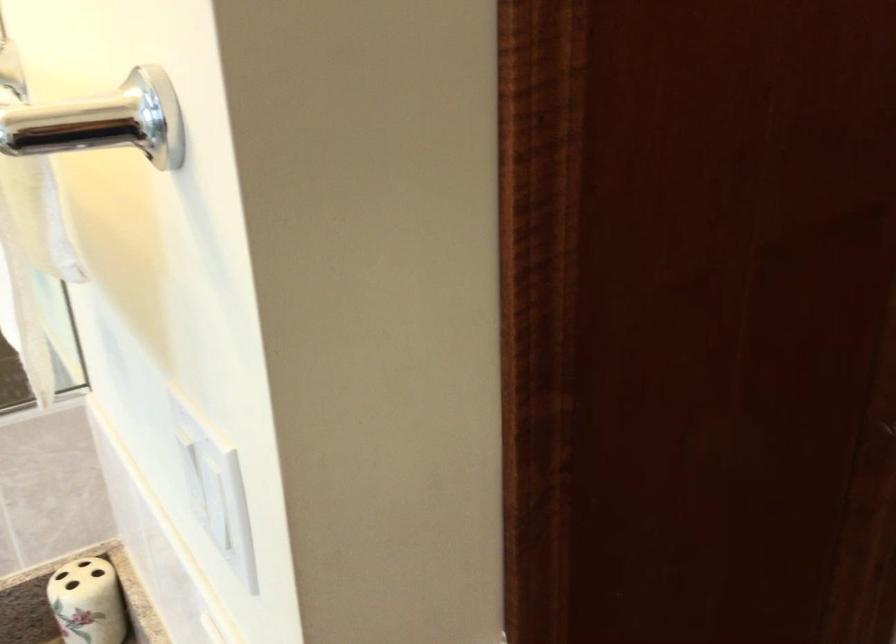
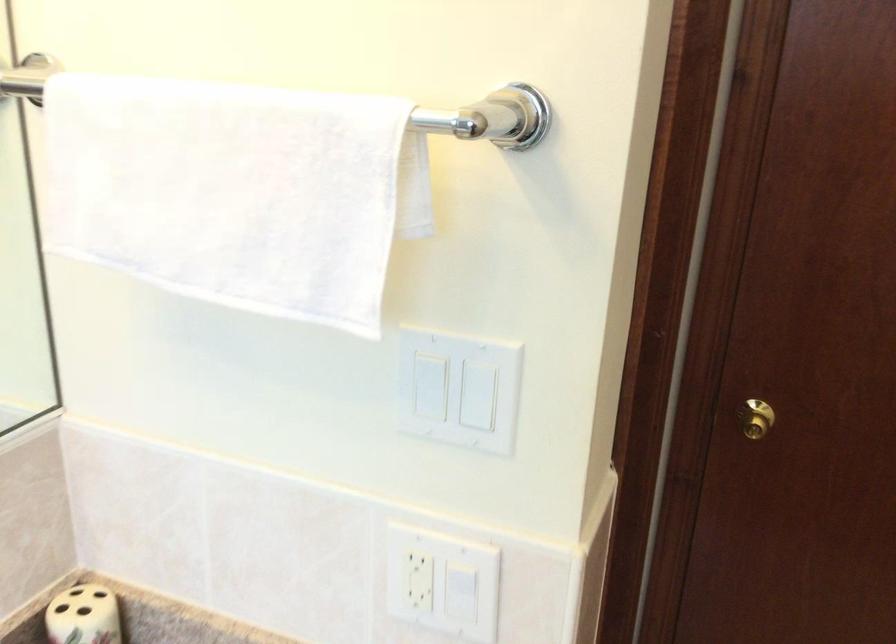
Locate, in the second image, the point that corresponds to [243,498] in the first image.

(483, 395)